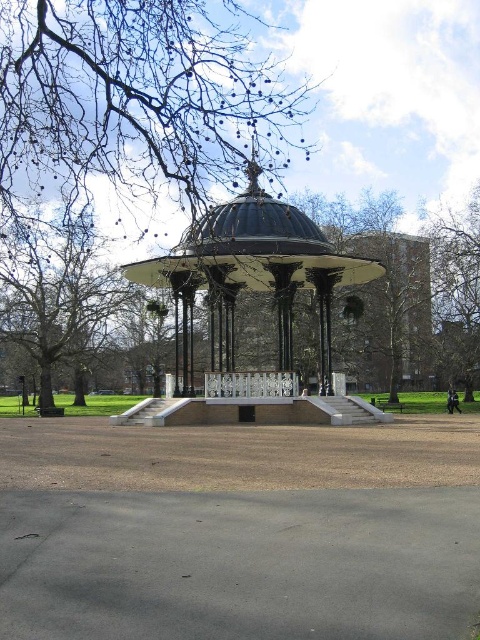
You are standing in the park and want to take a photo of the bandstand. You notice two points marked in the image, point 1 at coordinates point (81, 353) and point 2 at coordinates point (392, 404). Which point is closer to you, the photographer?

Point (81, 353) is closer to you than point (392, 404) because it is further to the viewer in the image.

From the picture: You are a park visitor trying to decide which tree to climb for a better view. The smooth bark tree at upper center and the brown leafy tree at left are both options. Which tree would give you a higher vantage point?

The smooth bark tree at upper center has a greater height compared to the brown leafy tree at left, so it would provide a higher vantage point.

You are standing at the base of the bandstand and looking towards the trees. Which tree, the smooth bark tree at upper center or the brown leafy tree at left, is positioned higher in the image?

The smooth bark tree at upper center is positioned higher in the image than the brown leafy tree at left.